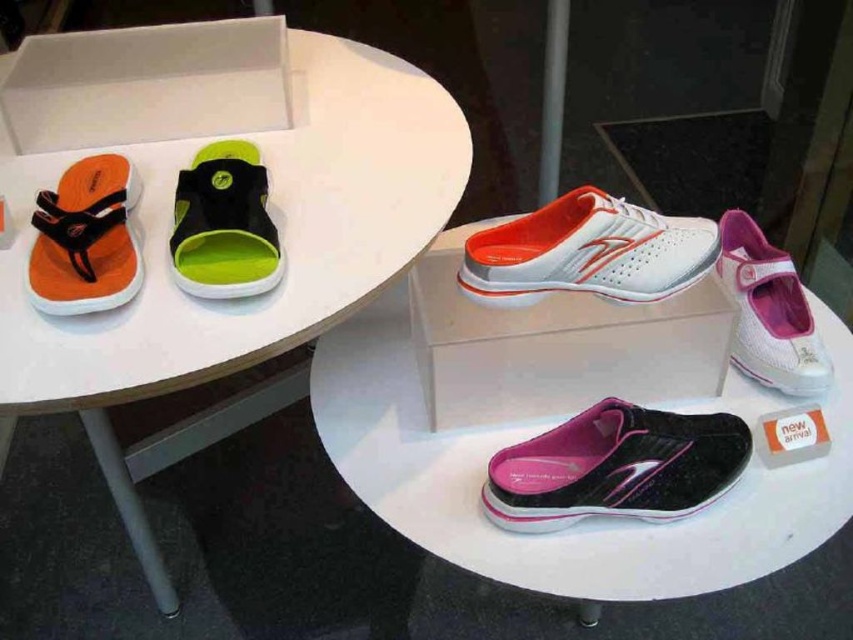
Question: Does neon green rubber sandal at upper left have a larger size compared to pink mesh running shoe at upper right?

Choices:
 (A) yes
 (B) no

Answer: (B)

Question: Estimate the real-world distances between objects in this image. Which object is farther from the neon green rubber sandal at upper left?

Choices:
 (A) white mesh shoe at upper center
 (B) transparent plastic shoe at center
 (C) white matte slip-on shoe at center
 (D) orange matte sandal at left

Answer: (A)

Question: Which point is closer to the camera?

Choices:
 (A) orange matte sandal at left
 (B) transparent plastic shoe at center
 (C) neon green rubber sandal at upper left
 (D) white plastic table at upper left

Answer: (D)

Question: Is shiny black running shoe at lower center bigger than white matte slip-on shoe at center?

Choices:
 (A) no
 (B) yes

Answer: (A)

Question: Which of the following is the farthest from the observer?

Choices:
 (A) tap(496, 456)
 (B) tap(223, 204)
 (C) tap(631, 284)

Answer: (A)

Question: Can you confirm if white plastic table at upper left is smaller than shiny black running shoe at lower center?

Choices:
 (A) no
 (B) yes

Answer: (A)